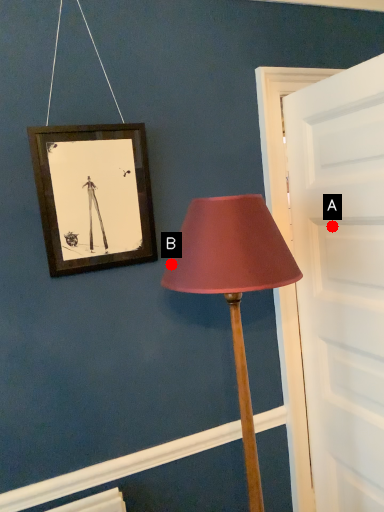
Question: Two points are circled on the image, labeled by A and B beside each circle. Which point is closer to the camera taking this photo?

Choices:
 (A) A is closer
 (B) B is closer

Answer: (B)